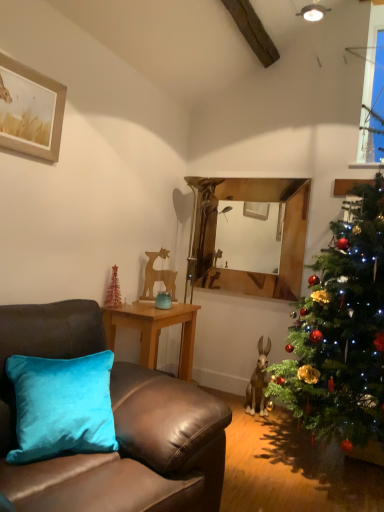
The image size is (384, 512). Find the location of `free point below green matte christmas tree at right (from a real-world perspective)`. free point below green matte christmas tree at right (from a real-world perspective) is located at coordinates (307, 461).